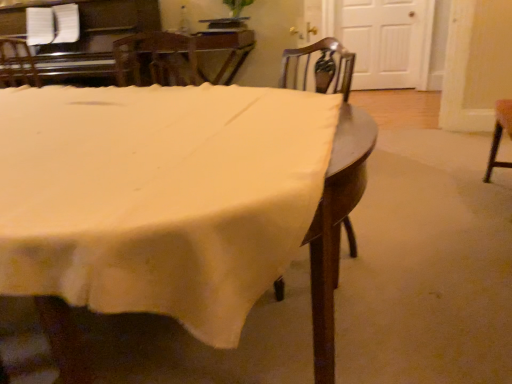
Where is `vacant space to the right of wooden at center`? The image size is (512, 384). vacant space to the right of wooden at center is located at coordinates (392, 252).